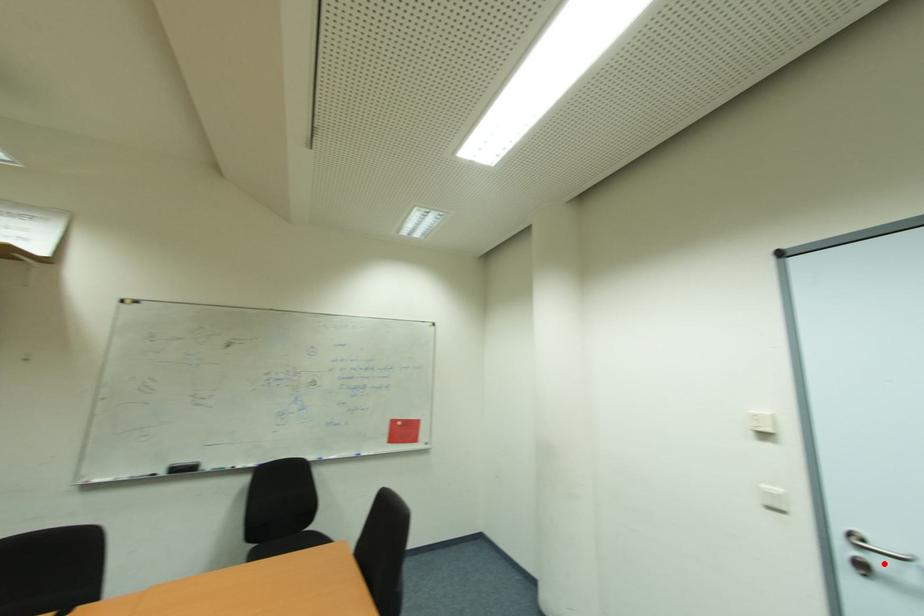
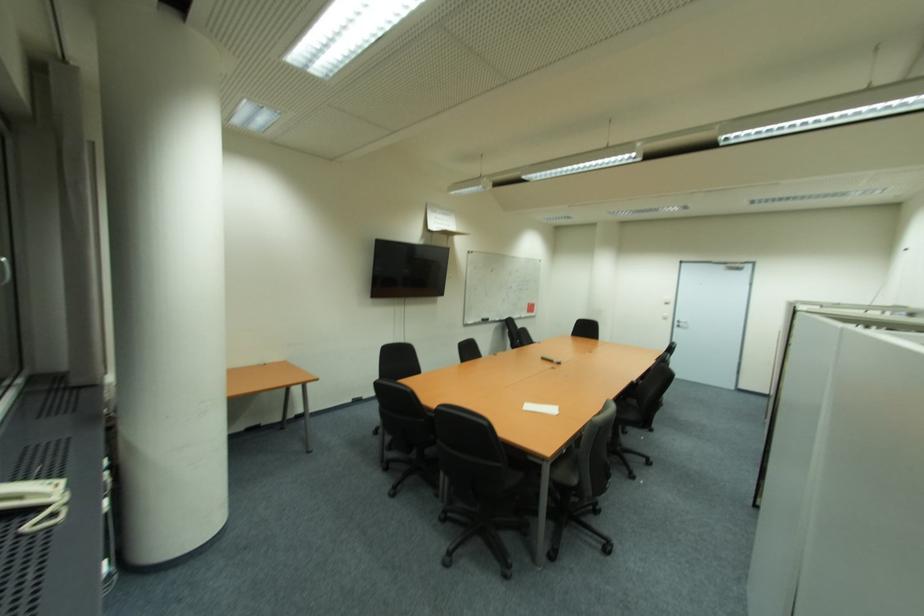
Question: I am providing you with two images of the same scene from different viewpoints. Given a red point in image1, look at the same physical point in image2. Is it:

Choices:
 (A) Closer to the viewpoint
 (B) Farther from the viewpoint

Answer: (B)